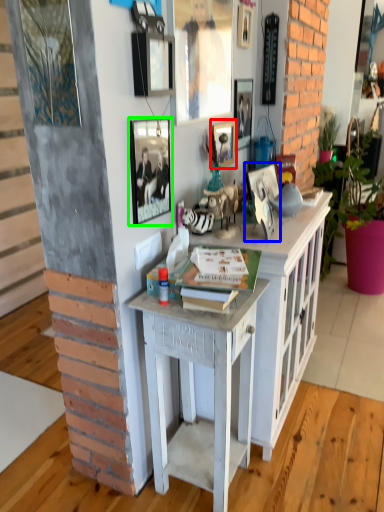
Question: Considering the real-world distances, which object is farthest from picture frame (highlighted by a red box)? picture frame (highlighted by a blue box) or picture frame (highlighted by a green box)?

Choices:
 (A) picture frame
 (B) picture frame

Answer: (B)